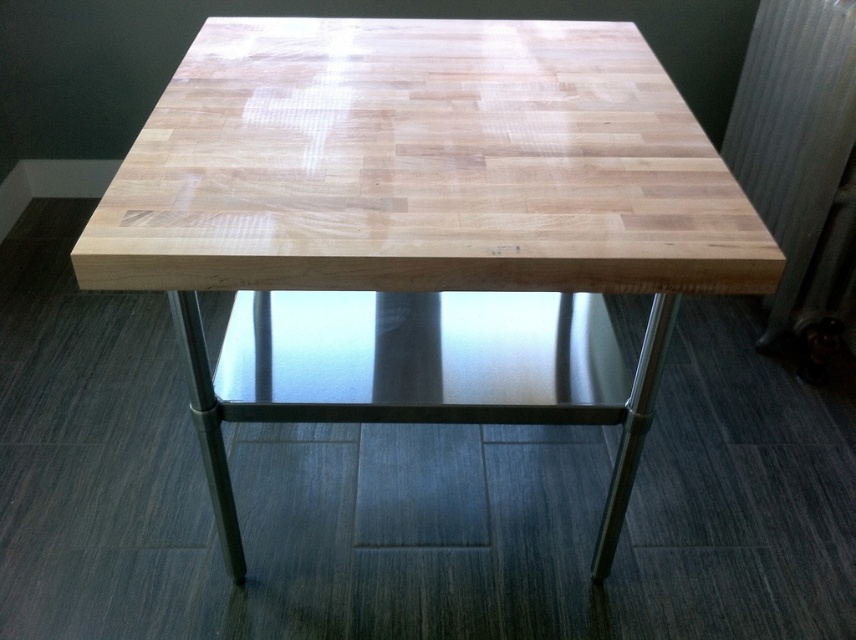
You are sitting on the metallic silver stool at center and want to place a book on the natural wood table at center. In which direction should you move the book to place it on the table?

The natural wood table at center is to the right of the metallic silver stool at center, so you should move the book to the right to place it on the table.

You are a delivery person trying to place a large package between the metallic silver stool at center and the metallic silver radiator at right. The package measures 32 inches in width. Will there be enough space to fit it between them?

The distance between the metallic silver stool at center and the metallic silver radiator at right is 34.33 inches. Since the package is 32 inches wide, there will be enough space to fit it between them.

You are sitting on the metallic silver stool at center and want to place a book on the natural wood table at center. Will your arms need to reach upward to place the book on the table?

The natural wood table at center is much taller than the metallic silver stool at center, so yes, you will need to reach upward to place the book on the table.